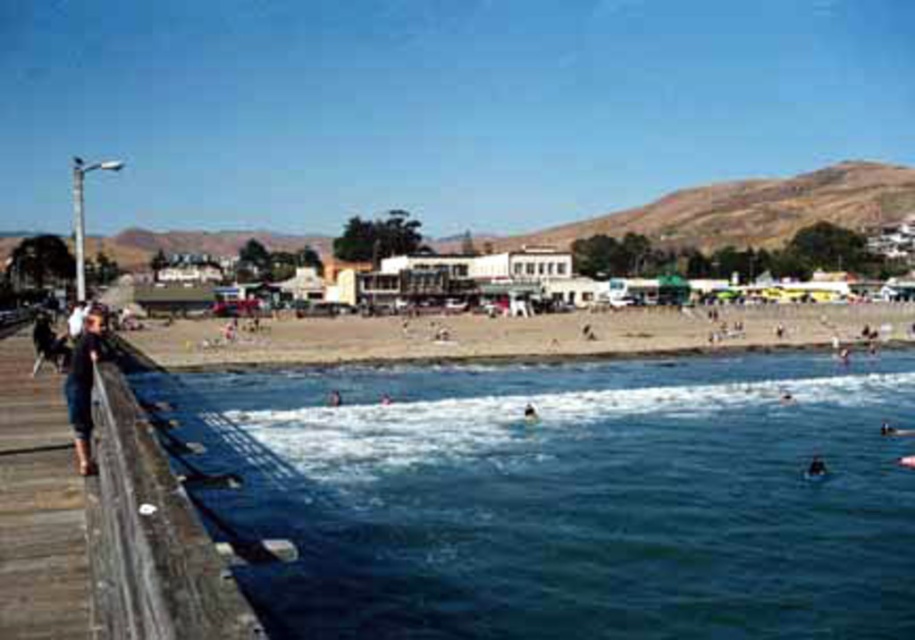
Question: Is blue water at lower center closer to camera compared to dark blue jeans at left?

Choices:
 (A) yes
 (B) no

Answer: (A)

Question: Which point is closer to the camera taking this photo?

Choices:
 (A) (240, 342)
 (B) (93, 362)
 (C) (529, 410)

Answer: (B)

Question: Considering the real-world distances, which object is farthest from the dark blue jeans at left?

Choices:
 (A) wooden dock at lower left
 (B) dark blue skin at lower right

Answer: (B)

Question: Which of the following is the farthest from the observer?

Choices:
 (A) wooden dock at lower left
 (B) dark blue jeans at left
 (C) beige sand beach at center
 (D) dark blue skin at lower right

Answer: (C)

Question: Does dark blue jeans at left have a greater width compared to dark blue skin at lower right?

Choices:
 (A) yes
 (B) no

Answer: (A)

Question: Does blue water at lower center appear under beige sand beach at center?

Choices:
 (A) yes
 (B) no

Answer: (A)